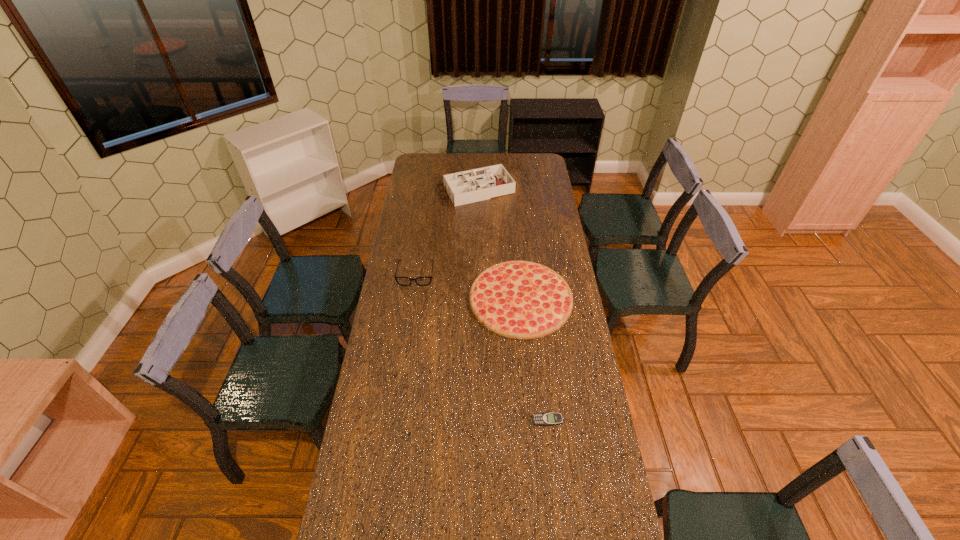
Image resolution: width=960 pixels, height=540 pixels. I want to click on object that is at the left edge, so click(403, 281).

Identify the location of pizza situated at the right edge. (519, 299).

Identify the location of beeper that is at the right edge. The height and width of the screenshot is (540, 960). (541, 419).

The height and width of the screenshot is (540, 960). In the image, there is a desktop. In order to click on free space at the far edge in this screenshot , I will do tap(445, 163).

You are a GUI agent. You are given a task and a screenshot of the screen. Output one action in this format:
    pyautogui.click(x=<x>, y=<y>)
    Task: Click on the vacant space at the left edge of the desktop
    
    Given the screenshot: What is the action you would take?
    417,188

Identify the location of free space at the right edge of the desktop. This screenshot has height=540, width=960. (554, 350).

This screenshot has width=960, height=540. Find the location of `free space at the far left corner`. free space at the far left corner is located at coordinates (433, 156).

Identify the location of vacant space in between the second tallest object and the farthest object. (446, 233).

Find the location of `vacant space in between the pizza and the spectacles`. vacant space in between the pizza and the spectacles is located at coordinates (468, 287).

The height and width of the screenshot is (540, 960). Identify the location of free spot between the nearest object and the pizza. (534, 359).